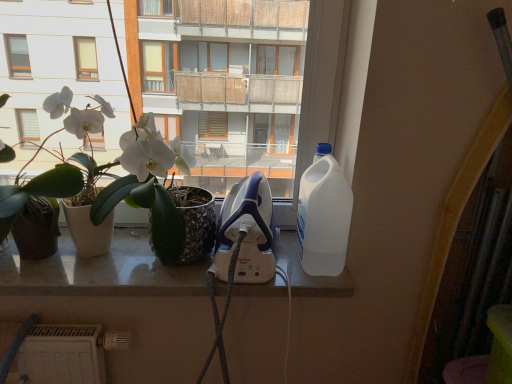
The image size is (512, 384). I want to click on empty space that is ontop of white glossy iron at center (from a real-world perspective), so click(x=139, y=258).